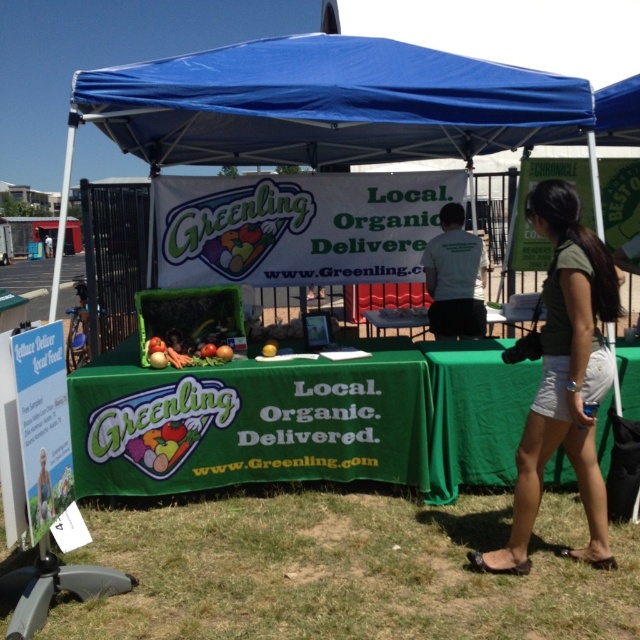
Question: Which of the following is the closest to the observer?

Choices:
 (A) white cotton shirt at center
 (B) green fabric shorts at lower right
 (C) blue fabric canopy at upper center
 (D) matte plastic bag of vegetables at center

Answer: (B)

Question: Does green fabric shorts at lower right have a lesser width compared to green cloth tablecloth at lower right?

Choices:
 (A) no
 (B) yes

Answer: (A)

Question: Which object is positioned farthest from the green fabric table at center?

Choices:
 (A) green cloth tablecloth at lower right
 (B) green fabric shorts at lower right
 (C) green grass at lower center

Answer: (B)

Question: Considering the relative positions of green fabric shorts at lower right and green cloth tablecloth at lower right in the image provided, where is green fabric shorts at lower right located with respect to green cloth tablecloth at lower right?

Choices:
 (A) left
 (B) right

Answer: (B)

Question: Is green cloth tablecloth at lower right to the left of matte plastic bag of vegetables at center from the viewer's perspective?

Choices:
 (A) no
 (B) yes

Answer: (A)

Question: Which point is closer to the camera?

Choices:
 (A) green grass at lower center
 (B) blue fabric canopy at upper center

Answer: (A)